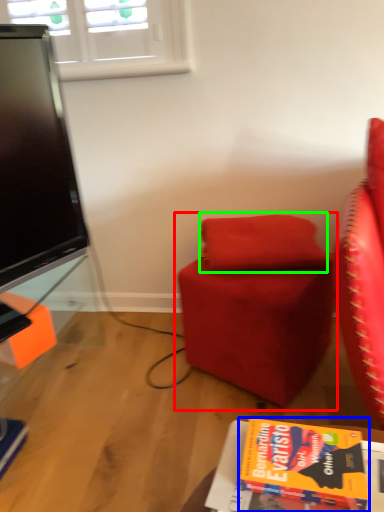
Question: Estimate the real-world distances between objects in this image. Which object is closer to chair (highlighted by a red box), book (highlighted by a blue box) or pillow (highlighted by a green box)?

Choices:
 (A) book
 (B) pillow

Answer: (B)